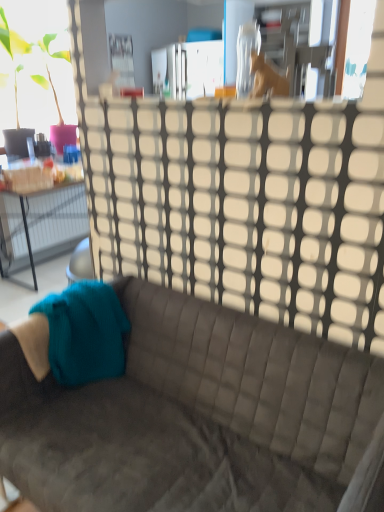
The height and width of the screenshot is (512, 384). I want to click on teal knitted fabric at lower left, so click(80, 334).

The height and width of the screenshot is (512, 384). Identify the location of transparent plastic glass door at upper center. (236, 207).

What is the approximate height of suede gray couch at center?

It is 27.56 inches.

Measure the distance between point (247,419) and camera.

The depth of point (247,419) is 1.44 meters.

Where is `wooden horse at upper center`? This screenshot has height=512, width=384. wooden horse at upper center is located at coordinates (257, 67).

Is the surface of suede gray couch at center in direct contact with transparent plastic glass door at upper center?

No, suede gray couch at center is not touching transparent plastic glass door at upper center.

Considering the positions of point (44, 463) and point (203, 149), is point (44, 463) closer or farther from the camera than point (203, 149)?

Point (44, 463) appears to be closer to the viewer than point (203, 149).

Is suede gray couch at center to the left of transparent plastic glass door at upper center from the viewer's perspective?

Correct, you'll find suede gray couch at center to the left of transparent plastic glass door at upper center.

Locate an element on the screen. The image size is (384, 512). glass door above the suede gray couch at center (from the image's perspective) is located at coordinates (236, 207).

How many degrees apart are the facing directions of wooden horse at upper center and transparent plastic glass door at upper center?

The angular difference between wooden horse at upper center and transparent plastic glass door at upper center is 180 degrees.

Considering the relative sizes of wooden horse at upper center and transparent plastic glass door at upper center in the image provided, is wooden horse at upper center smaller than transparent plastic glass door at upper center?

Correct, wooden horse at upper center occupies less space than transparent plastic glass door at upper center.

Is wooden horse at upper center in front of or behind transparent plastic glass door at upper center in the image?

In the image, wooden horse at upper center appears behind transparent plastic glass door at upper center.

From the image's perspective, is suede gray couch at center positioned above or below wooden horse at upper center?

suede gray couch at center is below wooden horse at upper center.

Does suede gray couch at center have a lesser height compared to wooden horse at upper center?

No.

Would you consider suede gray couch at center to be distant from wooden horse at upper center?

Absolutely, suede gray couch at center is distant from wooden horse at upper center.

Could you tell me if suede gray couch at center is turned towards wooden horse at upper center?

No, suede gray couch at center is not facing towards wooden horse at upper center.

Are transparent plastic glass door at upper center and suede gray couch at center making contact?

No.

Which of these two, transparent plastic glass door at upper center or suede gray couch at center, stands shorter?

suede gray couch at center is shorter.

Between transparent plastic glass door at upper center and suede gray couch at center, which one is positioned behind?

transparent plastic glass door at upper center.

Which object is positioned more to the left, transparent plastic glass door at upper center or suede gray couch at center?

suede gray couch at center is more to the left.

Would you say teal knitted fabric at lower left is part of transparent plastic glass door at upper center's contents?

No, transparent plastic glass door at upper center does not contain teal knitted fabric at lower left.

From the picture: Which is nearer, (x=345, y=146) or (x=67, y=377)?

Point (x=345, y=146) is positioned closer to the camera compared to point (x=67, y=377).

Is transparent plastic glass door at upper center at the left side of teal knitted fabric at lower left?

No.

Is teal knitted fabric at lower left outside of suede gray couch at center?

Actually, teal knitted fabric at lower left is within suede gray couch at center.

Find the location of a particular element. The image size is (384, 512). fabric that appears above the suede gray couch at center (from a real-world perspective) is located at coordinates (80, 334).

Looking at this image, is teal knitted fabric at lower left wider or thinner than suede gray couch at center?

Clearly, teal knitted fabric at lower left has less width compared to suede gray couch at center.

Between teal knitted fabric at lower left and suede gray couch at center, which one has smaller size?

teal knitted fabric at lower left is smaller.

From a real-world perspective, who is located lower, suede gray couch at center or teal knitted fabric at lower left?

From a 3D spatial view, suede gray couch at center is below.

Can you confirm if suede gray couch at center is positioned to the right of teal knitted fabric at lower left?

Indeed, suede gray couch at center is positioned on the right side of teal knitted fabric at lower left.

Measure the distance between suede gray couch at center and teal knitted fabric at lower left.

They are 11.03 inches apart.

Is suede gray couch at center smaller than teal knitted fabric at lower left?

No.

This screenshot has width=384, height=512. I want to click on glass door that is on the right side of suede gray couch at center, so click(236, 207).

In the image, there is a wooden horse at upper center. What are the coordinates of `glass door below it (from the image's perspective)` in the screenshot? It's located at (236, 207).

When comparing their distances from suede gray couch at center, does teal knitted fabric at lower left or wooden horse at upper center seem further?

wooden horse at upper center is further to suede gray couch at center.

Estimate the real-world distances between objects in this image. Which object is closer to teal knitted fabric at lower left, wooden horse at upper center or transparent plastic glass door at upper center?

transparent plastic glass door at upper center is positioned closer to the anchor teal knitted fabric at lower left.

Based on their spatial positions, is teal knitted fabric at lower left or suede gray couch at center further from transparent plastic glass door at upper center?

teal knitted fabric at lower left is positioned further to the anchor transparent plastic glass door at upper center.

When comparing their distances from teal knitted fabric at lower left, does suede gray couch at center or transparent plastic glass door at upper center seem further?

Based on the image, transparent plastic glass door at upper center appears to be further to teal knitted fabric at lower left.

Which object lies nearer to the anchor point transparent plastic glass door at upper center, suede gray couch at center or wooden horse at upper center?

suede gray couch at center is positioned closer to the anchor transparent plastic glass door at upper center.

From the image, which object appears to be nearer to wooden horse at upper center, transparent plastic glass door at upper center or teal knitted fabric at lower left?

transparent plastic glass door at upper center is closer to wooden horse at upper center.

Looking at the image, which one is located closer to transparent plastic glass door at upper center, wooden horse at upper center or teal knitted fabric at lower left?

Among the two, teal knitted fabric at lower left is located nearer to transparent plastic glass door at upper center.

From the image, which object appears to be farther from teal knitted fabric at lower left, transparent plastic glass door at upper center or suede gray couch at center?

transparent plastic glass door at upper center lies further to teal knitted fabric at lower left than the other object.

You are a GUI agent. You are given a task and a screenshot of the screen. Output one action in this format:
    pyautogui.click(x=<x>, y=<y>)
    Task: Click on the fabric between wooden horse at upper center and suede gray couch at center in the vertical direction
    This screenshot has width=384, height=512.
    Given the screenshot: What is the action you would take?
    pyautogui.click(x=80, y=334)

The width and height of the screenshot is (384, 512). In order to click on glass door between wooden horse at upper center and suede gray couch at center from top to bottom in this screenshot , I will do `click(236, 207)`.

Locate an element on the screen. Image resolution: width=384 pixels, height=512 pixels. fabric between transparent plastic glass door at upper center and suede gray couch at center from top to bottom is located at coordinates (80, 334).

The width and height of the screenshot is (384, 512). I want to click on glass door between wooden horse at upper center and teal knitted fabric at lower left from top to bottom, so click(236, 207).